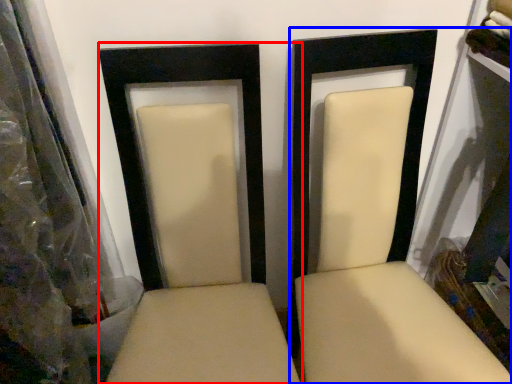
Question: Which object appears farthest to the camera in this image, chair (highlighted by a red box) or chair (highlighted by a blue box)?

Choices:
 (A) chair
 (B) chair

Answer: (B)